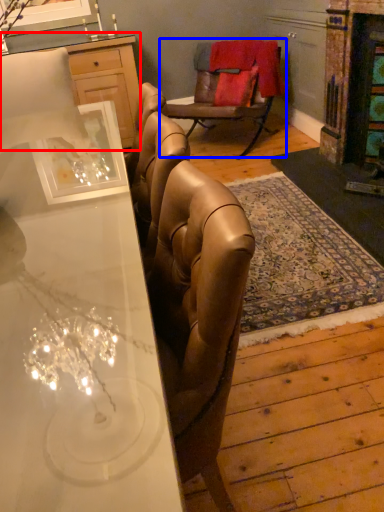
Question: Which of the following is the farthest to the observer, cabinetry (highlighted by a red box) or chair (highlighted by a blue box)?

Choices:
 (A) cabinetry
 (B) chair

Answer: (A)